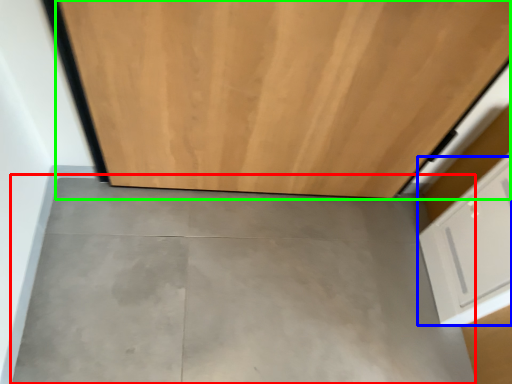
Question: Based on their relative distances, which object is nearer to concrete (highlighted by a red box)? Choose from drawer (highlighted by a blue box) and door (highlighted by a green box).

Choices:
 (A) drawer
 (B) door

Answer: (B)